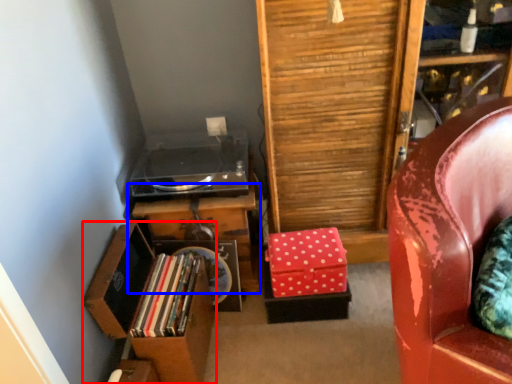
Question: Among these objects, which one is farthest to the camera, file cabinet (highlighted by a red box) or table (highlighted by a blue box)?

Choices:
 (A) file cabinet
 (B) table

Answer: (B)